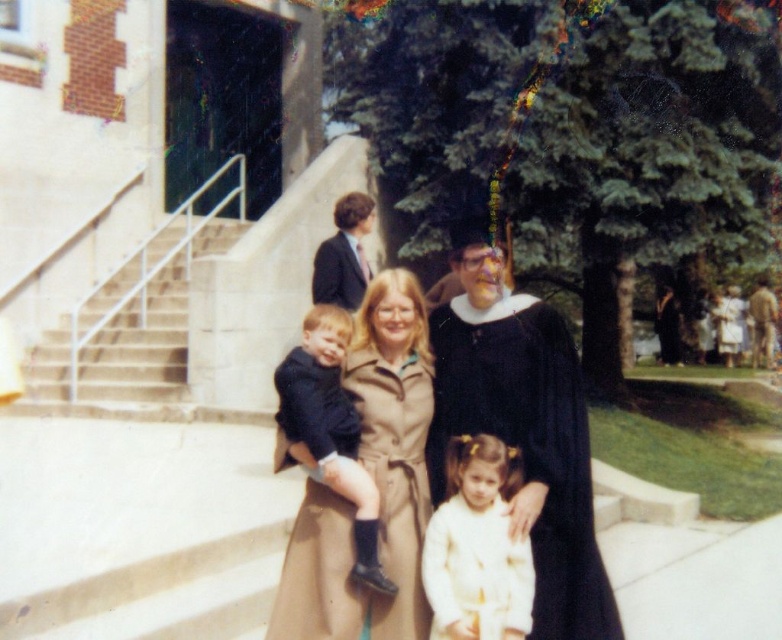
Between black matte graduation gown at center and tan suede trench coat at center, which one is positioned higher?

Positioned higher is black matte graduation gown at center.

Does point (494, 312) come farther from viewer compared to point (400, 548)?

Yes, point (494, 312) is farther from viewer.

Locate an element on the screen. This screenshot has width=782, height=640. black matte graduation gown at center is located at coordinates (522, 429).

Does point (41, 387) come behind point (357, 236)?

Yes, point (41, 387) is behind point (357, 236).

Who is taller, white concrete stairs at left or matte black suit at upper center?

white concrete stairs at left is taller.

Is point (56, 412) behind point (359, 298)?

Yes.

Where is `white concrete stairs at left`? white concrete stairs at left is located at coordinates (117, 349).

Does black matte graduation gown at center appear under matte black suit at upper center?

Correct, black matte graduation gown at center is located below matte black suit at upper center.

Can you confirm if black matte graduation gown at center is positioned to the left of matte black suit at upper center?

Incorrect, black matte graduation gown at center is not on the left side of matte black suit at upper center.

This screenshot has height=640, width=782. What do you see at coordinates (522, 429) in the screenshot? I see `black matte graduation gown at center` at bounding box center [522, 429].

In order to click on black matte graduation gown at center in this screenshot , I will do `click(522, 429)`.